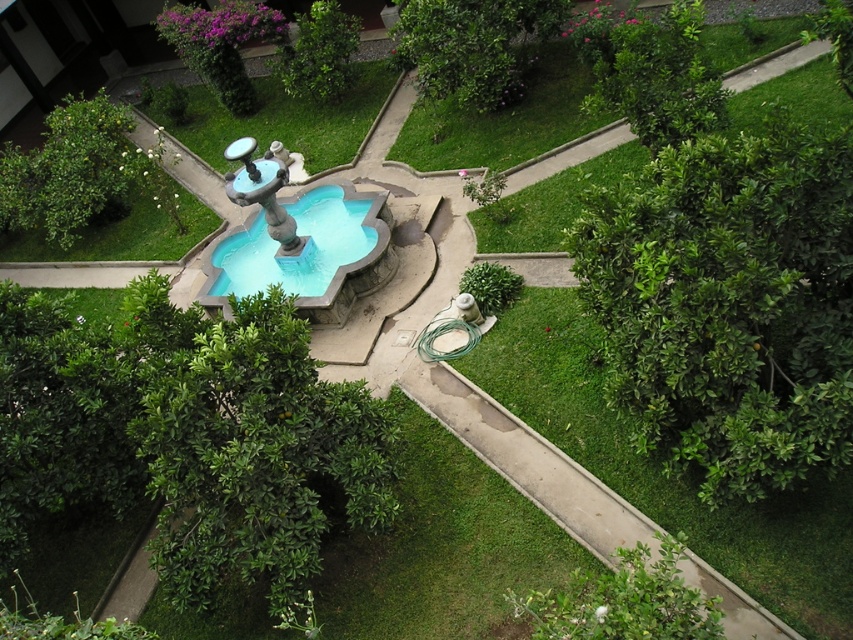
Can you confirm if green leafy bush at right is wider than green leafy bush at upper left?

In fact, green leafy bush at right might be narrower than green leafy bush at upper left.

Who is higher up, green leafy bush at right or green leafy bush at upper left?

green leafy bush at upper left is higher up.

This screenshot has width=853, height=640. Describe the element at coordinates (728, 304) in the screenshot. I see `green leafy bush at right` at that location.

This screenshot has height=640, width=853. What are the coordinates of `green leafy bush at right` in the screenshot? It's located at (728, 304).

Can you confirm if green leafy tree at upper right is taller than green leafy bush at upper left?

In fact, green leafy tree at upper right may be shorter than green leafy bush at upper left.

Is green leafy tree at upper right smaller than green leafy bush at upper left?

Indeed, green leafy tree at upper right has a smaller size compared to green leafy bush at upper left.

Is point (685, 68) closer to viewer compared to point (108, 205)?

Yes, it is.

Where is `green leafy tree at upper right`? The height and width of the screenshot is (640, 853). green leafy tree at upper right is located at coordinates (653, 72).

Does green leafy bush at upper center have a lesser width compared to green leafy tree at upper center?

No, green leafy bush at upper center is not thinner than green leafy tree at upper center.

Image resolution: width=853 pixels, height=640 pixels. Identify the location of green leafy bush at upper center. 474,45.

This screenshot has width=853, height=640. What are the coordinates of `green leafy bush at upper center` in the screenshot? It's located at (x=474, y=45).